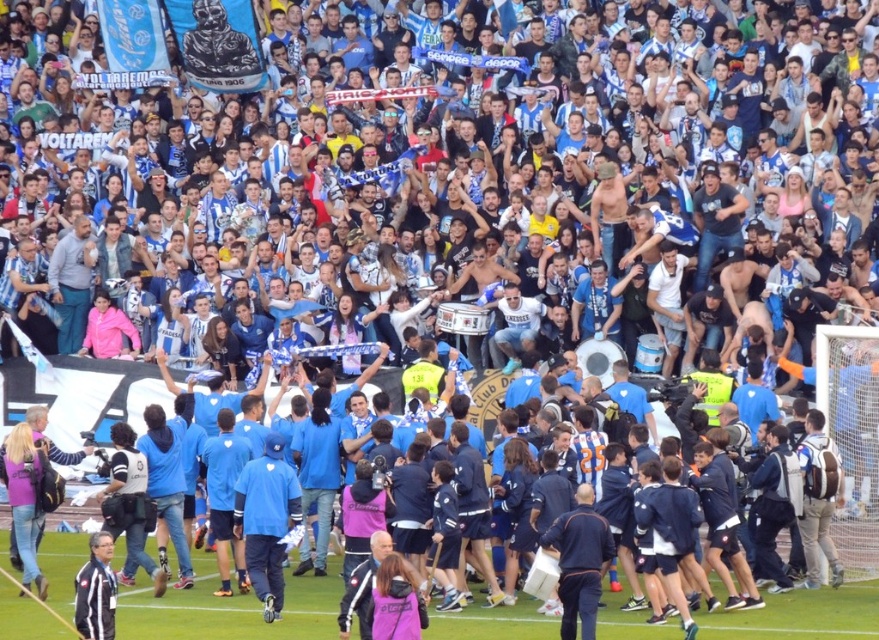
Question: Among these points, which one is farthest from the camera?

Choices:
 (A) [826, 627]
 (B) [437, 625]

Answer: (B)

Question: Observing the image, what is the correct spatial positioning of blue fabric jersey at center in reference to green grass at lower center?

Choices:
 (A) left
 (B) right

Answer: (A)

Question: Which of the following is the farthest from the observer?

Choices:
 (A) (70, 556)
 (B) (200, 596)

Answer: (A)

Question: Observing the image, what is the correct spatial positioning of blue fabric jersey at center in reference to green grass at lower center?

Choices:
 (A) below
 (B) above

Answer: (B)

Question: In this image, where is blue fabric jersey at center located relative to green grass at lower center?

Choices:
 (A) above
 (B) below

Answer: (A)